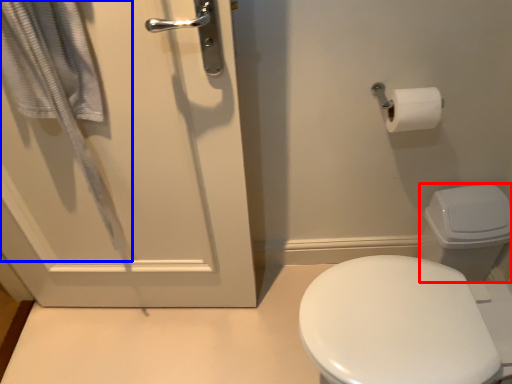
Question: Which object is further to the camera taking this photo, toilet bowl (highlighted by a red box) or bath towel (highlighted by a blue box)?

Choices:
 (A) toilet bowl
 (B) bath towel

Answer: (A)